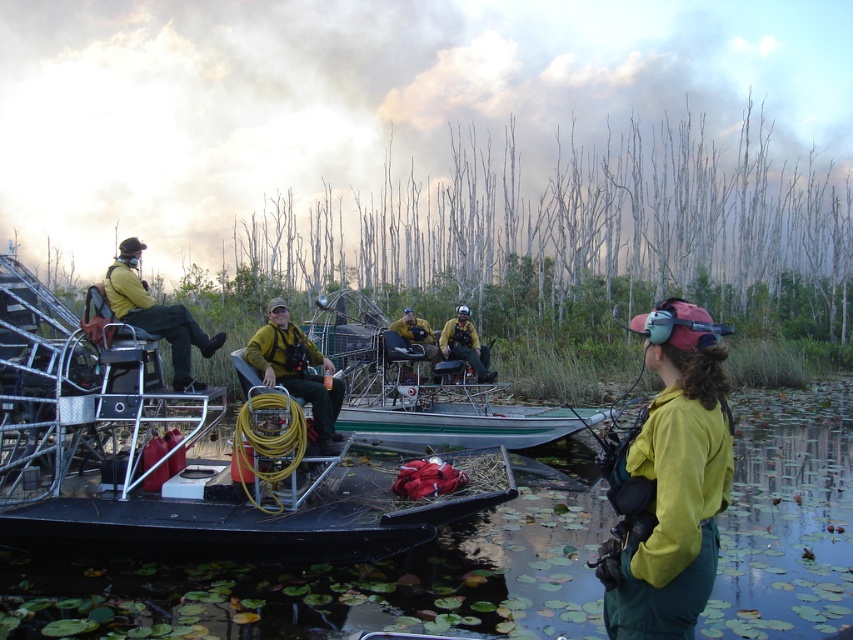
Question: Observing the image, what is the correct spatial positioning of yellow matte jacket at center in reference to yellow matte uniform at center?

Choices:
 (A) right
 (B) left

Answer: (A)

Question: Which object appears farthest from the camera in this image?

Choices:
 (A) yellow matte jacket at center
 (B) yellow fire-resistant suit at center

Answer: (B)

Question: Which point is farther to the camera?

Choices:
 (A) yellow-green fabric jacket at left
 (B) yellow matte jacket at center
 (C) metallic yellow boat at center

Answer: (A)

Question: Considering the relative positions of transparent water at boat front and yellow fire-resistant suit at center in the image provided, where is transparent water at boat front located with respect to yellow fire-resistant suit at center?

Choices:
 (A) right
 (B) left

Answer: (A)

Question: Is yellow matte uniform at center positioned before yellow fire-resistant suit at center?

Choices:
 (A) yes
 (B) no

Answer: (A)

Question: Which point is farther to the camera?

Choices:
 (A) (112, 296)
 (B) (440, 348)

Answer: (B)